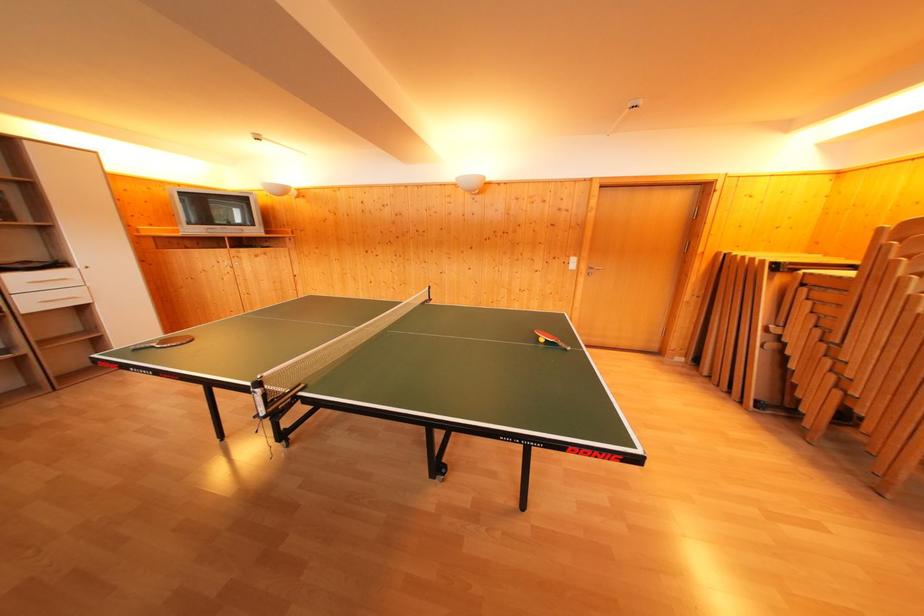
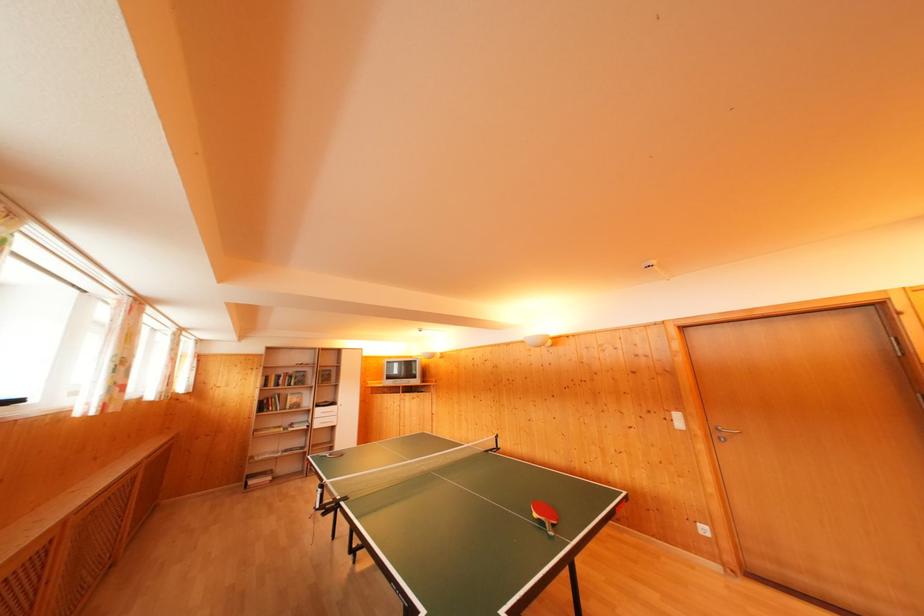
The point at (578, 265) is marked in the first image. Where is the corresponding point in the second image?

(682, 421)